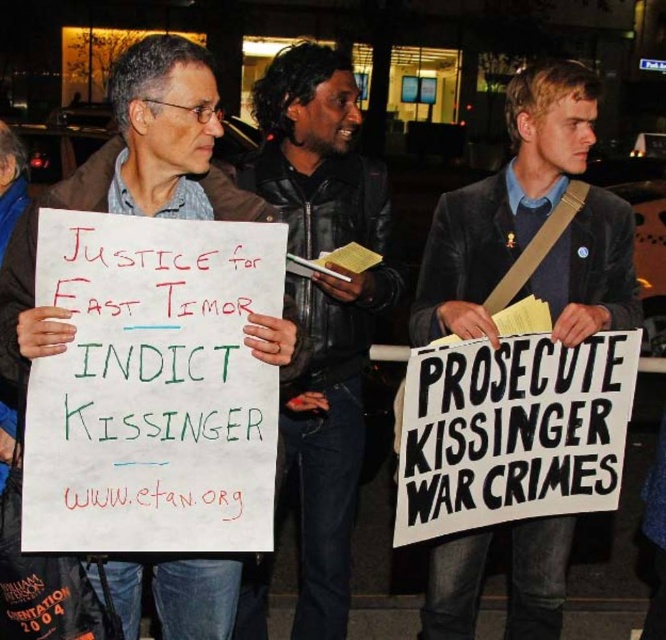
Question: Which of the following is the closest to the observer?

Choices:
 (A) (320, 336)
 (B) (521, 596)

Answer: (B)

Question: Considering the real-world distances, which object is closest to the white paper sign at left?

Choices:
 (A) dark gray suit at center
 (B) black leather jacket at center

Answer: (B)

Question: Can you confirm if dark gray suit at center is wider than white paper sign at left?

Choices:
 (A) yes
 (B) no

Answer: (A)

Question: Is black leather jacket at center closer to the viewer compared to white paper sign at left?

Choices:
 (A) yes
 (B) no

Answer: (B)

Question: Which of these objects is positioned farthest from the dark gray suit at center?

Choices:
 (A) black leather jacket at center
 (B) white paper sign at left

Answer: (B)

Question: Is dark gray suit at center positioned before white paper sign at left?

Choices:
 (A) no
 (B) yes

Answer: (A)